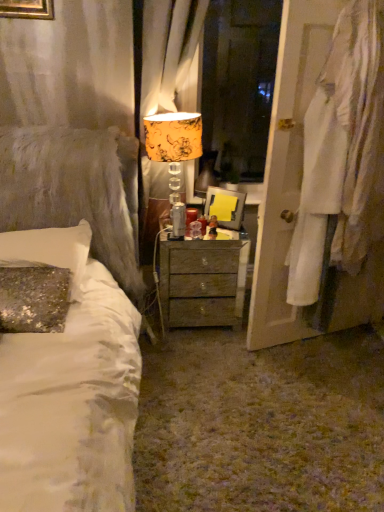
Question: In the image, is wooden nightstand at center on the left side or the right side of sequined fabric pillow at left?

Choices:
 (A) right
 (B) left

Answer: (A)

Question: Considering the positions of wooden nightstand at center and sequined fabric pillow at left in the image, is wooden nightstand at center bigger or smaller than sequined fabric pillow at left?

Choices:
 (A) small
 (B) big

Answer: (B)

Question: Estimate the real-world distances between objects in this image. Which object is farther from the matte plastic picture frame at center?

Choices:
 (A) orange floral fabric curtain at upper center
 (B) yellow floral fabric lampshade at center
 (C) wooden nightstand at center
 (D) white fabric at right
 (E) sequined fabric pillow at left

Answer: (E)

Question: Which object is positioned farthest from the yellow floral fabric lampshade at center?

Choices:
 (A) orange floral fabric curtain at upper center
 (B) sequined fabric pillow at left
 (C) white fabric at right
 (D) wooden nightstand at center
 (E) matte plastic picture frame at center

Answer: (D)